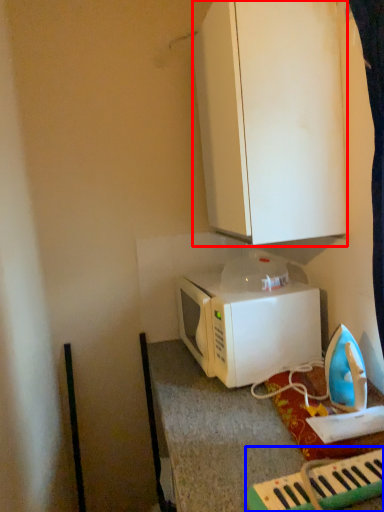
Question: Which object is further to the camera taking this photo, cabinetry (highlighted by a red box) or musical keyboard (highlighted by a blue box)?

Choices:
 (A) cabinetry
 (B) musical keyboard

Answer: (A)